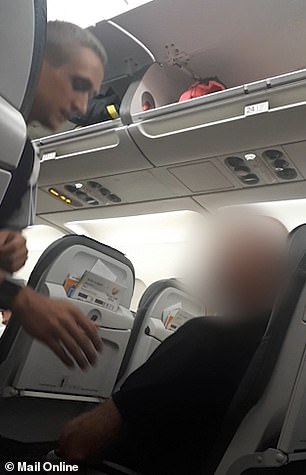
The image size is (306, 475). I want to click on tray table, so click(117, 344), click(147, 345).